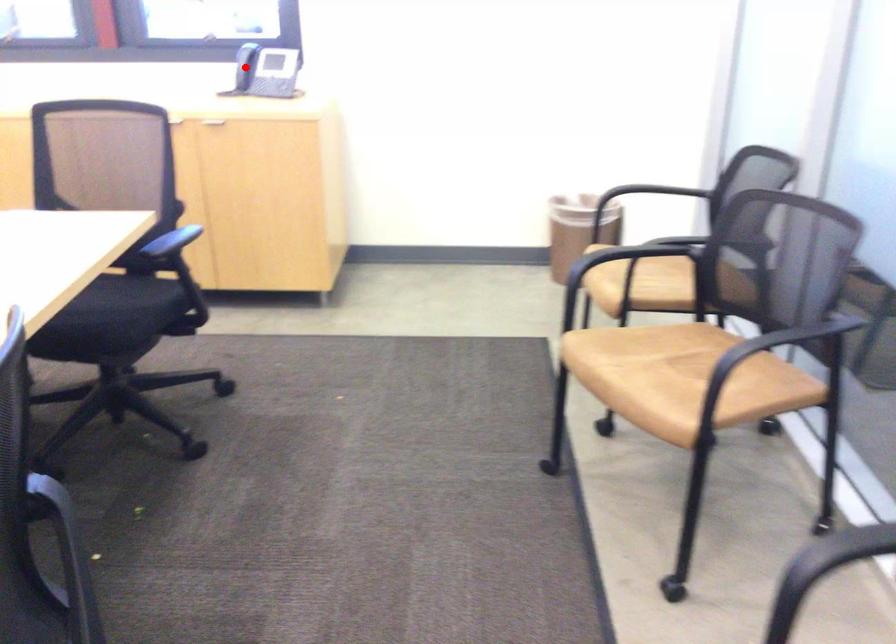
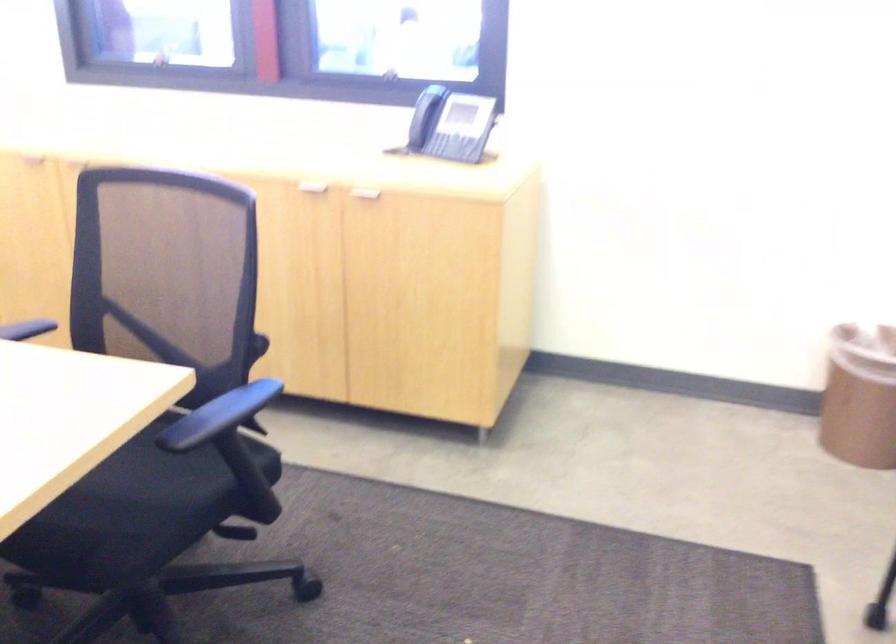
Find the pixel in the second image that matches the highlighted location in the first image.

(421, 118)